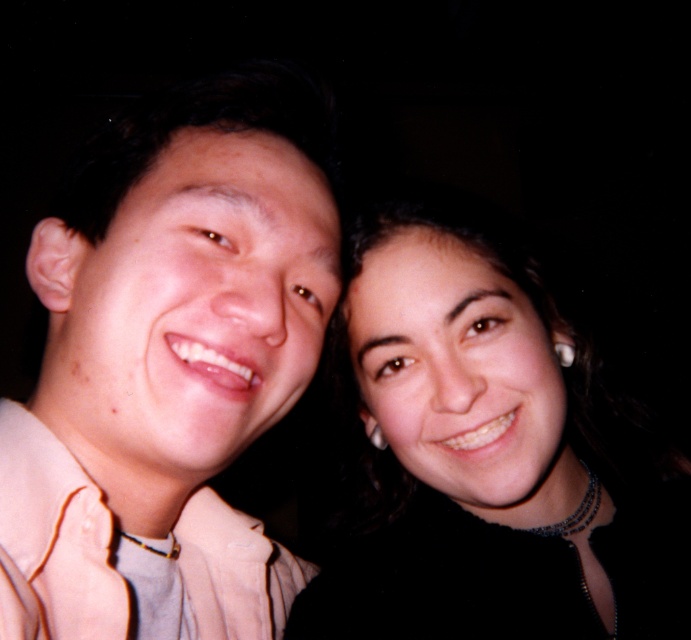
You are standing in front of a photo of two people. The photo has a point marked at coordinates [169,364]. Which object in the photo is located exactly at that point?

The light beige shirt at left is located exactly at point [169,364].

You are a photographer standing in front of the light beige shirt at left. You want to take a closeup shot of it. What is the minimum distance you need to maintain to focus properly?

The minimum distance you need to maintain to focus properly is 12.44 inches because the light beige shirt at left and viewer are 12.44 inches apart.

You are taking a photo of two friends. You need to place a sticker on the light beige shirt at left and another sticker on the smooth black hair at center. According to the image, which sticker should you place first if you start from the left side of the photo?

You should place the sticker on the light beige shirt at left first because it is positioned on the left side of the smooth black hair at center.